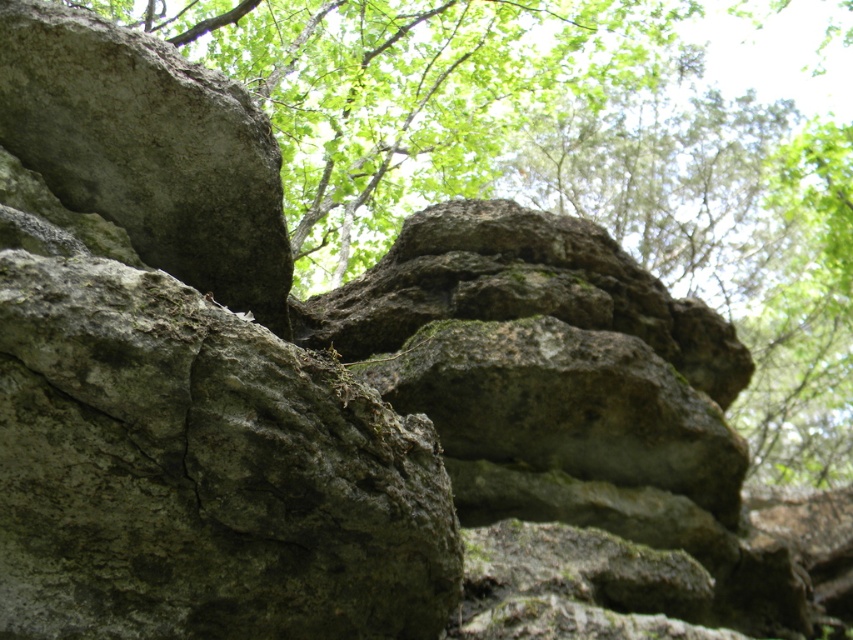
Question: Does green mossy rock at upper center appear under gray rough rock at upper left?

Choices:
 (A) yes
 (B) no

Answer: (B)

Question: Does green mossy rock at upper center have a greater width compared to gray rough rock at upper left?

Choices:
 (A) no
 (B) yes

Answer: (B)

Question: Is green mossy rock at upper center thinner than gray rough rock at upper left?

Choices:
 (A) yes
 (B) no

Answer: (B)

Question: Which point is farther from the camera taking this photo?

Choices:
 (A) (187, 92)
 (B) (576, 42)

Answer: (B)